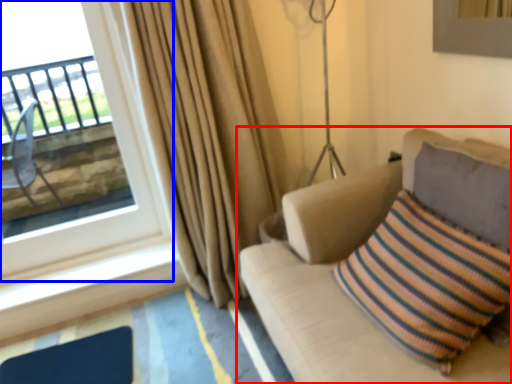
Question: Among these objects, which one is nearest to the camera, studio couch (highlighted by a red box) or window (highlighted by a blue box)?

Choices:
 (A) studio couch
 (B) window

Answer: (A)